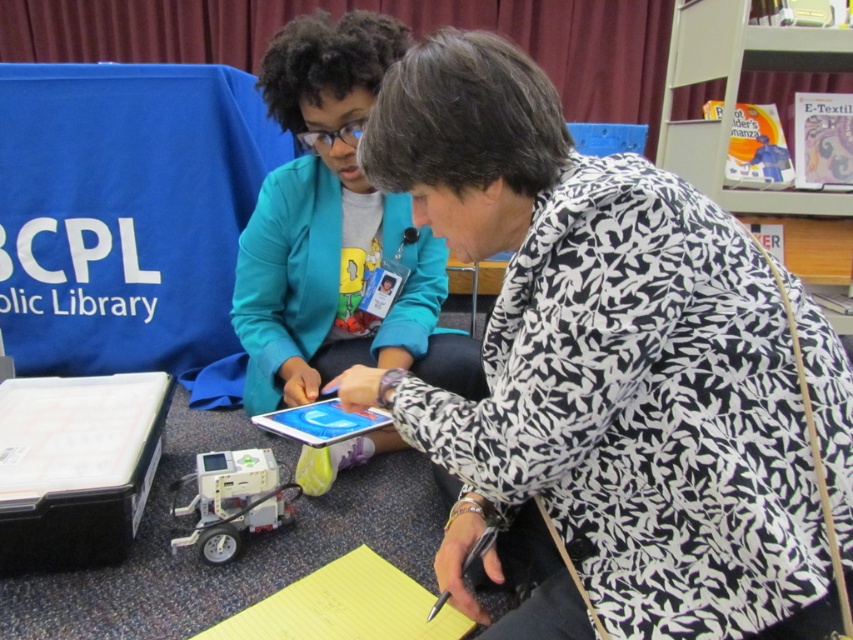
Question: Which point is closer to the camera?

Choices:
 (A) (248, 506)
 (B) (289, 310)

Answer: (A)

Question: Among these objects, which one is farthest from the camera?

Choices:
 (A) metallic plastic robot at lower left
 (B) black printed shirt at center

Answer: (A)

Question: Estimate the real-world distances between objects in this image. Which object is closer to the metallic plastic robot at lower left?

Choices:
 (A) black printed shirt at center
 (B) teal fabric jacket at center

Answer: (B)

Question: Can you confirm if black printed shirt at center is positioned to the left of metallic plastic robot at lower left?

Choices:
 (A) yes
 (B) no

Answer: (B)

Question: Considering the relative positions of black printed shirt at center and metallic plastic robot at lower left in the image provided, where is black printed shirt at center located with respect to metallic plastic robot at lower left?

Choices:
 (A) left
 (B) right

Answer: (B)

Question: Is the position of black printed shirt at center more distant than that of teal fabric jacket at center?

Choices:
 (A) no
 (B) yes

Answer: (A)